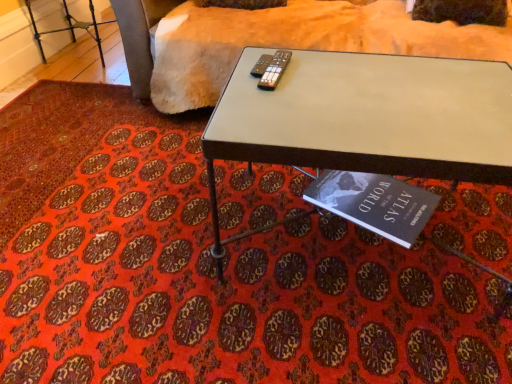
Question: From the image's perspective, is hardcover book at lower center located above soft beige fabric at upper center?

Choices:
 (A) no
 (B) yes

Answer: (A)

Question: Is hardcover book at lower center aimed at soft beige fabric at upper center?

Choices:
 (A) yes
 (B) no

Answer: (B)

Question: Considering the relative sizes of hardcover book at lower center and soft beige fabric at upper center in the image provided, is hardcover book at lower center smaller than soft beige fabric at upper center?

Choices:
 (A) yes
 (B) no

Answer: (A)

Question: Can you confirm if hardcover book at lower center is wider than soft beige fabric at upper center?

Choices:
 (A) yes
 (B) no

Answer: (B)

Question: Is soft beige fabric at upper center inside hardcover book at lower center?

Choices:
 (A) no
 (B) yes

Answer: (A)

Question: From the image's perspective, is hardcover book at lower center above or below metallic gray table at center?

Choices:
 (A) above
 (B) below

Answer: (B)

Question: In terms of height, does hardcover book at lower center look taller or shorter compared to metallic gray table at center?

Choices:
 (A) short
 (B) tall

Answer: (A)

Question: Is point (315, 200) positioned closer to the camera than point (289, 140)?

Choices:
 (A) farther
 (B) closer

Answer: (A)

Question: Would you say hardcover book at lower center is inside or outside metallic gray table at center?

Choices:
 (A) outside
 (B) inside

Answer: (B)

Question: Is metallic silver remote at center inside the boundaries of soft beige fabric at upper center, or outside?

Choices:
 (A) inside
 (B) outside

Answer: (B)

Question: From a real-world perspective, is metallic silver remote at center above or below soft beige fabric at upper center?

Choices:
 (A) above
 (B) below

Answer: (A)

Question: From the image's perspective, is metallic silver remote at center positioned above or below soft beige fabric at upper center?

Choices:
 (A) above
 (B) below

Answer: (B)

Question: Looking at the image, does metallic silver remote at center seem bigger or smaller compared to soft beige fabric at upper center?

Choices:
 (A) big
 (B) small

Answer: (B)

Question: From a real-world perspective, relative to hardcover book at lower center, is metallic silver remote at center vertically above or below?

Choices:
 (A) above
 (B) below

Answer: (A)

Question: Is metallic silver remote at center to the left or to the right of hardcover book at lower center in the image?

Choices:
 (A) right
 (B) left

Answer: (B)